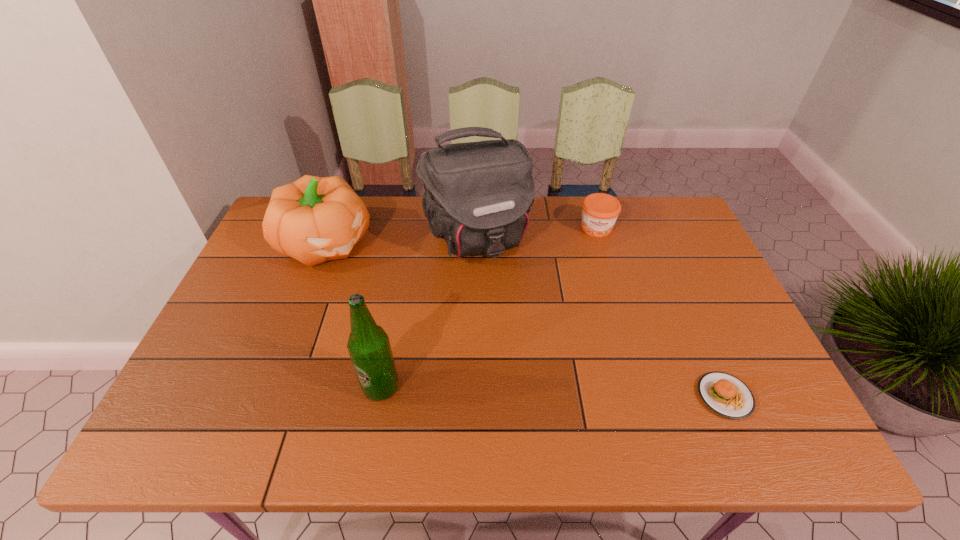
I want to click on vacant space located on the left of the shortest object, so click(667, 396).

Find the location of `vacant space situated 0.180m on the front label of the fourth object from left to right`. vacant space situated 0.180m on the front label of the fourth object from left to right is located at coordinates (597, 280).

Locate an element on the screen. Image resolution: width=960 pixels, height=540 pixels. vacant position located on the front label of the fourth object from left to right is located at coordinates (597, 280).

Identify the location of free region located 0.120m on the front label of the fourth object from left to right. This screenshot has width=960, height=540. (597, 266).

Locate an element on the screen. This screenshot has width=960, height=540. free location located 0.380m on the open flap of the shoulder bag is located at coordinates (546, 380).

The image size is (960, 540). What are the coordinates of `free space located 0.170m on the open flap of the shoulder bag` in the screenshot? It's located at (515, 314).

The width and height of the screenshot is (960, 540). Find the location of `vacant region located 0.170m on the open flap of the shoulder bag`. vacant region located 0.170m on the open flap of the shoulder bag is located at coordinates (515, 314).

You are a GUI agent. You are given a task and a screenshot of the screen. Output one action in this format:
    pyautogui.click(x=<x>, y=<y>)
    Task: Click on the vacant space located on the carved face of the third tallest object
    Image resolution: width=960 pixels, height=540 pixels.
    Given the screenshot: What is the action you would take?
    pyautogui.click(x=364, y=275)

This screenshot has height=540, width=960. Identify the location of vacant space situated 0.250m on the carved face of the third tallest object. (409, 311).

Find the location of a particular element. The width and height of the screenshot is (960, 540). vacant space located 0.230m on the carved face of the third tallest object is located at coordinates (404, 307).